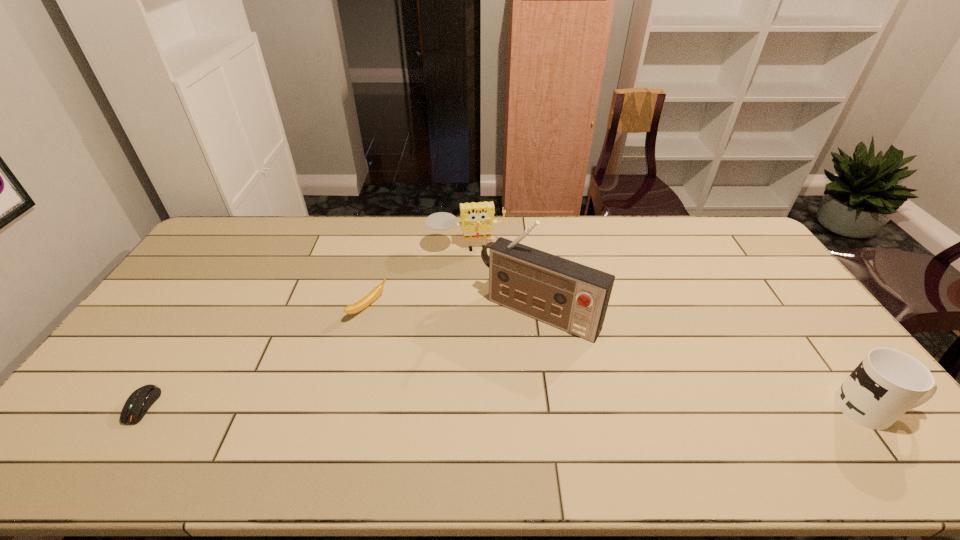
Locate an element on the screen. The width and height of the screenshot is (960, 540). empty location between the sponge and the mug is located at coordinates (669, 328).

Identify the location of vacant area between the tallest object and the second shortest object. Image resolution: width=960 pixels, height=540 pixels. (454, 311).

At what (x,y) coordinates should I click in order to perform the action: click on free point between the fourth object from right to left and the mug. Please return your answer as a coordinate pair (x, y). The width and height of the screenshot is (960, 540). Looking at the image, I should click on (620, 358).

This screenshot has height=540, width=960. I want to click on free space between the shortest object and the sponge, so click(304, 327).

The height and width of the screenshot is (540, 960). What are the coordinates of `empty space that is in between the farthest object and the leftmost object` in the screenshot? It's located at (304, 327).

Identify which object is the fourth closest to the sponge. Please provide its 2D coordinates. Your answer should be formatted as a tuple, i.e. [(x, y)], where the tuple contains the x and y coordinates of a point satisfying the conditions above.

[(887, 383)]

Find the location of a particular element. This screenshot has width=960, height=540. object identified as the closest to the tallest object is located at coordinates (477, 219).

Where is `free space that satisfies the following two spatial constraints: 1. on the front side of the mug; 2. on the handle side of the farthest object`? The width and height of the screenshot is (960, 540). free space that satisfies the following two spatial constraints: 1. on the front side of the mug; 2. on the handle side of the farthest object is located at coordinates (461, 408).

The image size is (960, 540). I want to click on free spot that satisfies the following two spatial constraints: 1. on the front side of the fourth tallest object; 2. on the right side of the tallest object, so click(x=367, y=314).

You are a GUI agent. You are given a task and a screenshot of the screen. Output one action in this format:
    pyautogui.click(x=<x>, y=<y>)
    Task: Click on the vacant position in the image that satisfies the following two spatial constraints: 1. on the button of the shortest object; 2. on the handle side of the mug
    This screenshot has height=540, width=960.
    Given the screenshot: What is the action you would take?
    pyautogui.click(x=141, y=408)